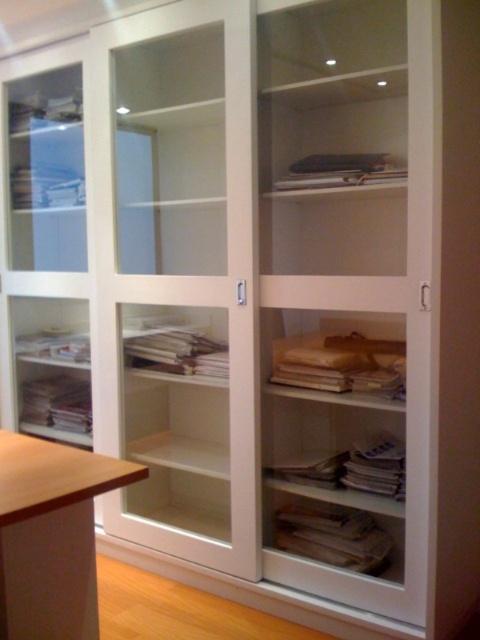
You are trying to move the wooden stool at lower left to the right side of the transparent glass cabinet at center. Will the stool fit next to the cabinet without overlapping?

The transparent glass cabinet at center might be wider than wooden stool at lower left, so there is a possibility that the stool will not fit next to the cabinet without overlapping. It is recommended to measure the width of both items before moving.

You are standing in front of the storage unit and want to reach two points inside it. The first point is at point (137, 314) and the second is at point (83, 618). Which point is closer to you?

Point (137, 314) is closer to you because it is further to the viewer than point (83, 618).

You are organizing your office and need to move a box from the wooden stool at lower left to the transparent glass cabinet at center. Which direction should you move the box to place it inside the cabinet?

The transparent glass cabinet at center is positioned on the right side of the wooden stool at lower left, so you should move the box to the right to place it inside the cabinet.